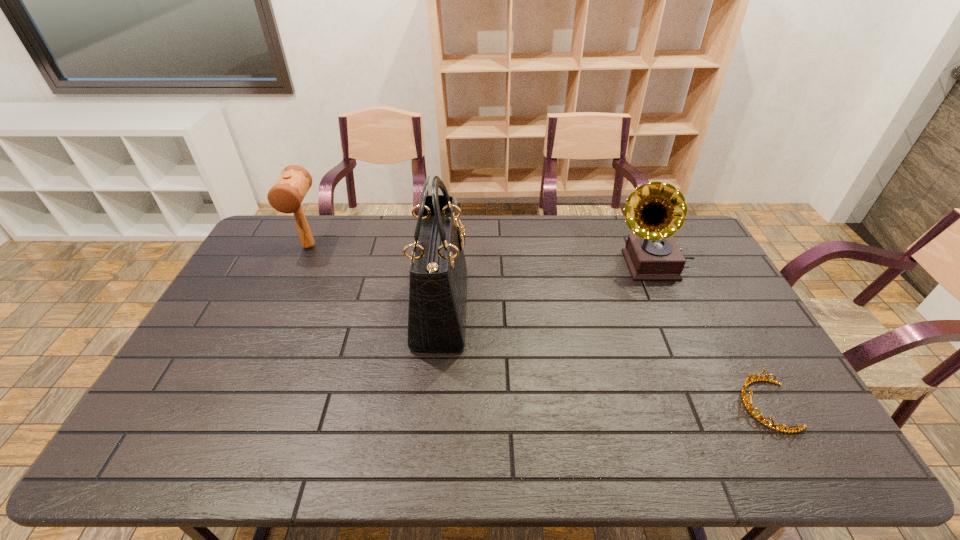
Locate an element on the screen. This screenshot has height=540, width=960. object that is at the far left corner is located at coordinates (286, 195).

I want to click on object at the far right corner, so click(x=655, y=211).

The width and height of the screenshot is (960, 540). I want to click on object at the near right corner, so click(x=748, y=381).

The height and width of the screenshot is (540, 960). I want to click on free region at the far edge of the desktop, so click(x=528, y=251).

This screenshot has width=960, height=540. Find the location of `free spot at the near edge of the desktop`. free spot at the near edge of the desktop is located at coordinates pos(532,457).

Locate an element on the screen. The image size is (960, 540). free space at the left edge of the desktop is located at coordinates (247, 268).

In the image, there is a desktop. Where is `vacant space at the far left corner`? vacant space at the far left corner is located at coordinates (293, 222).

This screenshot has height=540, width=960. What are the coordinates of `blank space at the near right corner of the desktop` in the screenshot? It's located at (773, 462).

The width and height of the screenshot is (960, 540). Find the location of `free space between the nearest object and the leftmost object`. free space between the nearest object and the leftmost object is located at coordinates (538, 326).

At what (x,y) coordinates should I click in order to perform the action: click on vacant region between the phonograph record and the shortest object. Please return your answer as a coordinate pair (x, y). This screenshot has width=960, height=540. Looking at the image, I should click on point(708,335).